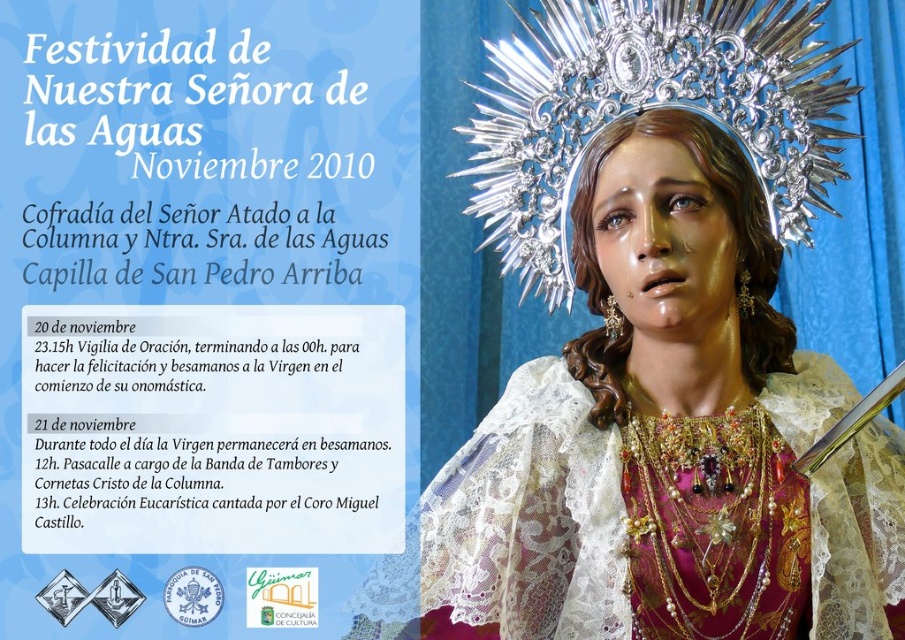
Is the position of white paper at upper left more distant than that of lace fabric at center?

Yes, white paper at upper left is behind lace fabric at center.

Which of these two, white paper at upper left or lace fabric at center, stands taller?

Standing taller between the two is white paper at upper left.

Is point (197, 618) farther from camera compared to point (813, 577)?

Yes, point (197, 618) is behind point (813, 577).

Identify the location of white paper at upper left. The width and height of the screenshot is (905, 640). (205, 310).

Which is more to the right, silver metallic crown at upper center or lace fabric at center?

Positioned to the right is silver metallic crown at upper center.

Who is higher up, silver metallic crown at upper center or lace fabric at center?

silver metallic crown at upper center

Which is in front, point (713, 8) or point (587, 552)?

Point (587, 552) is more forward.

Identify the location of silver metallic crown at upper center. This screenshot has width=905, height=640. (649, 108).

Measure the distance between point (405, 435) and camera.

They are 10.72 feet apart.

Does white paper at upper left appear over silver metallic crown at upper center?

Incorrect, white paper at upper left is not positioned above silver metallic crown at upper center.

Between point (50, 288) and point (563, 100), which one is positioned behind?

Point (50, 288)

Locate an element on the screen. The height and width of the screenshot is (640, 905). white paper at upper left is located at coordinates (205, 310).